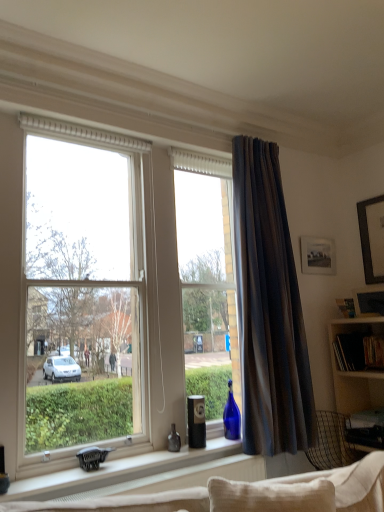
Question: Considering the positions of transparent glass window at center and dark grey textured curtain at right in the image, is transparent glass window at center taller or shorter than dark grey textured curtain at right?

Choices:
 (A) short
 (B) tall

Answer: (A)

Question: Is transparent glass window at center wider or thinner than dark grey textured curtain at right?

Choices:
 (A) wide
 (B) thin

Answer: (A)

Question: Estimate the real-world distances between objects in this image. Which object is closer to the matte black picture frame at upper right, placed as the 1th picture frame when sorted from back to front?

Choices:
 (A) matte glass bottle at window sill
 (B) wooden picture frame at upper right, the 2th picture frame in the top-to-bottom sequence
 (C) transparent glass window at center
 (D) white matte window sill at center
 (E) dark grey textured curtain at right

Answer: (B)

Question: Estimate the real-world distances between objects in this image. Which object is closer to the matte black picture frame at upper right, which is the 2th picture frame in front-to-back order?

Choices:
 (A) white matte window sill at center
 (B) matte glass bottle at window sill
 (C) wooden picture frame at upper right, the 1th picture frame in the front-to-back sequence
 (D) metallic silver desk at lower right
 (E) dark grey textured curtain at right

Answer: (C)